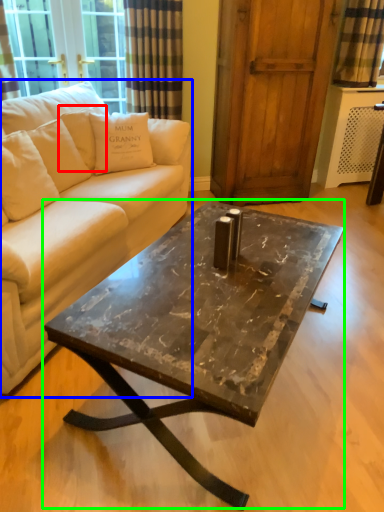
Question: Which object is the farthest from pillow (highlighted by a red box)? Choose among these: studio couch (highlighted by a blue box) or coffee table (highlighted by a green box).

Choices:
 (A) studio couch
 (B) coffee table

Answer: (B)